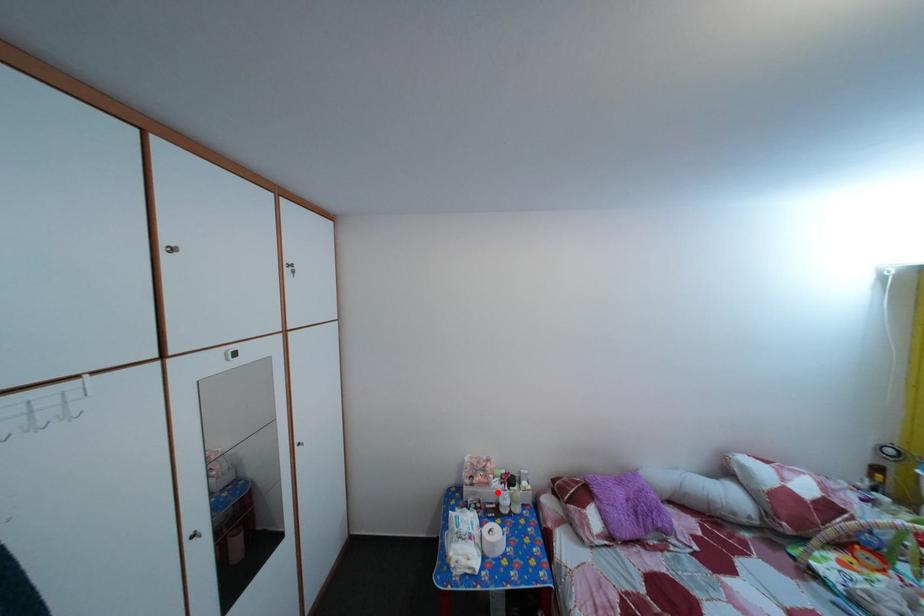
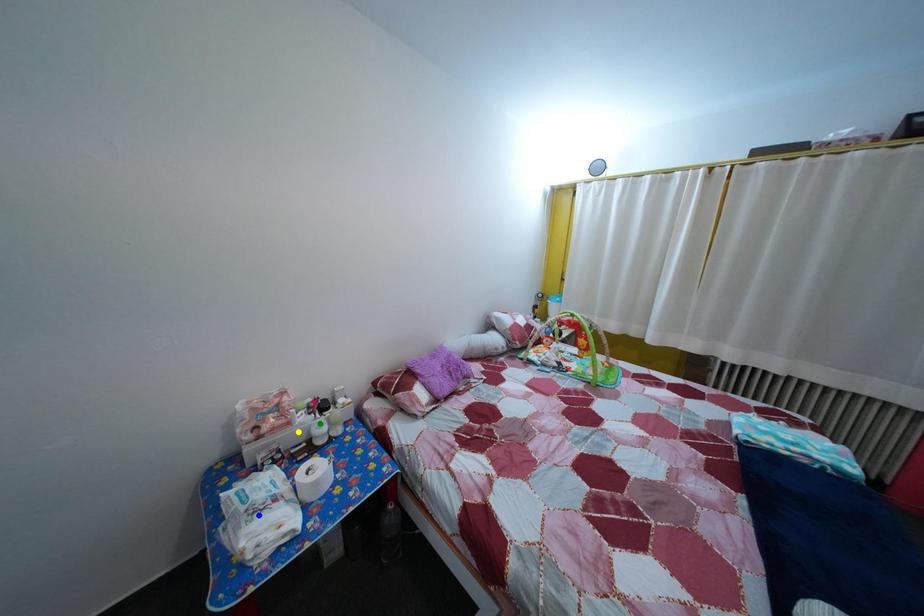
Question: I am providing you with two images of the same scene from different viewpoints. A red point is marked on the first image. You are given multiple points on the second image. Can you choose the point in image 2 that corresponds to the point in image 1?

Choices:
 (A) yellow point
 (B) blue point
 (C) green point

Answer: (A)